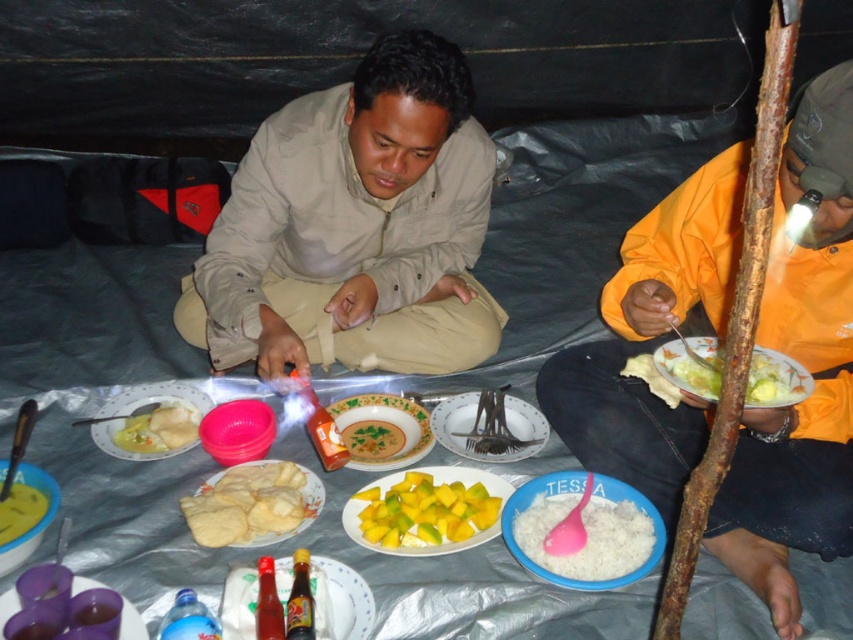
Between orange fabric jacket at upper right and white plastic table at center, which one appears on the left side from the viewer's perspective?

Positioned to the left is white plastic table at center.

Where is `orange fabric jacket at upper right`? orange fabric jacket at upper right is located at coordinates (807, 369).

Is point (730, 164) closer to camera compared to point (578, 634)?

No, (730, 164) is behind (578, 634).

Where is `orange fabric jacket at upper right`? orange fabric jacket at upper right is located at coordinates (807, 369).

Is point (727, 488) closer to viewer compared to point (466, 545)?

No.

Is orange fabric jacket at upper right to the left of yellow matte plate at center from the viewer's perspective?

Incorrect, orange fabric jacket at upper right is not on the left side of yellow matte plate at center.

The height and width of the screenshot is (640, 853). Find the location of `orange fabric jacket at upper right`. orange fabric jacket at upper right is located at coordinates (807, 369).

At what (x,y) coordinates should I click in order to perform the action: click on orange fabric jacket at upper right. Please return your answer as a coordinate pair (x, y). The image size is (853, 640). Looking at the image, I should click on (807, 369).

Where is `matte white plate at center left`? The width and height of the screenshot is (853, 640). matte white plate at center left is located at coordinates (155, 397).

Between matte white plate at center left and smooth yellowish rice at center, which one is positioned lower?

smooth yellowish rice at center is below.

At what (x,y) coordinates should I click in order to perform the action: click on matte white plate at center left. Please return your answer as a coordinate pair (x, y). This screenshot has width=853, height=640. Looking at the image, I should click on (155, 397).